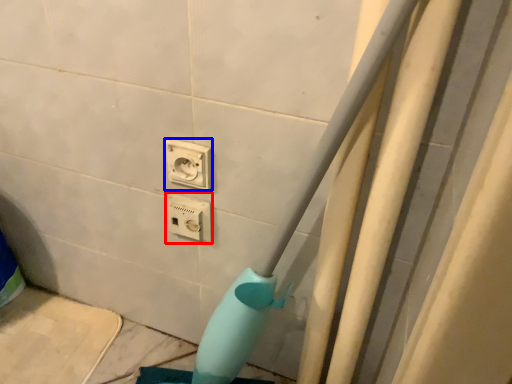
Question: Which point is further to the camera, power plugs and sockets (highlighted by a red box) or power plugs and sockets (highlighted by a blue box)?

Choices:
 (A) power plugs and sockets
 (B) power plugs and sockets

Answer: (A)